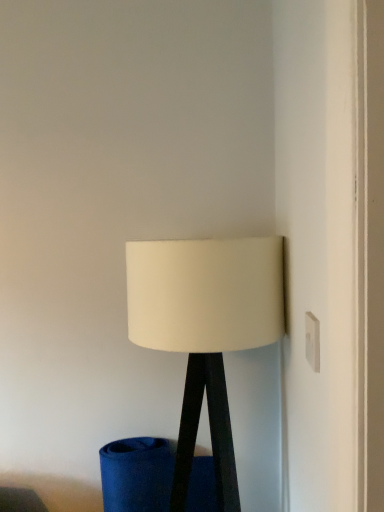
Question: Does white plastic electric outlet at upper right have a lesser width compared to white matte lampshade at center?

Choices:
 (A) no
 (B) yes

Answer: (B)

Question: Considering the relative sizes of white plastic electric outlet at upper right and white matte lampshade at center in the image provided, is white plastic electric outlet at upper right smaller than white matte lampshade at center?

Choices:
 (A) yes
 (B) no

Answer: (A)

Question: Does white plastic electric outlet at upper right have a greater width compared to white matte lampshade at center?

Choices:
 (A) no
 (B) yes

Answer: (A)

Question: From a real-world perspective, is white plastic electric outlet at upper right over white matte lampshade at center?

Choices:
 (A) no
 (B) yes

Answer: (B)

Question: Is white plastic electric outlet at upper right bigger than white matte lampshade at center?

Choices:
 (A) no
 (B) yes

Answer: (A)

Question: Can we say white plastic electric outlet at upper right lies outside white matte lampshade at center?

Choices:
 (A) no
 (B) yes

Answer: (B)

Question: Is white matte lampshade at center completely or partially outside of white plastic electric outlet at upper right?

Choices:
 (A) no
 (B) yes

Answer: (B)

Question: Is white matte lampshade at center at the left side of white plastic electric outlet at upper right?

Choices:
 (A) yes
 (B) no

Answer: (A)

Question: Is white matte lampshade at center taller than white plastic electric outlet at upper right?

Choices:
 (A) no
 (B) yes

Answer: (B)

Question: From a real-world perspective, is white matte lampshade at center over white plastic electric outlet at upper right?

Choices:
 (A) no
 (B) yes

Answer: (A)

Question: Is white matte lampshade at center smaller than white plastic electric outlet at upper right?

Choices:
 (A) yes
 (B) no

Answer: (B)

Question: Is white matte lampshade at center thinner than white plastic electric outlet at upper right?

Choices:
 (A) no
 (B) yes

Answer: (A)

Question: In the image, is white matte lampshade at center positioned in front of or behind white plastic electric outlet at upper right?

Choices:
 (A) behind
 (B) front

Answer: (A)